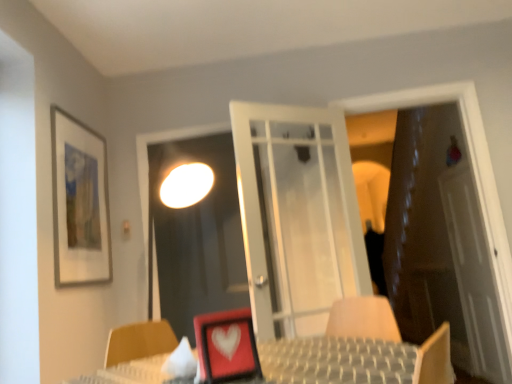
Question: From a real-world perspective, is brown leather door at right physically located above or below matte glass picture frame at upper left, positioned as the first picture frame in back-to-front order?

Choices:
 (A) above
 (B) below

Answer: (B)

Question: Relative to matte glass picture frame at upper left, positioned as the 2th picture frame in front-to-back order, is brown leather door at right in front or behind?

Choices:
 (A) front
 (B) behind

Answer: (B)

Question: Based on their relative distances, which object is farther from the matte glass picture frame at upper left, which is the second picture frame in right-to-left order?

Choices:
 (A) brown leather door at right
 (B) transparent glass screen door at center, the second screen door from the back
 (C) matte red picture frame at center, the second picture frame positioned from the left
 (D) white translucent screen door at right, which is counted as the 1th screen door, starting from the back

Answer: (A)

Question: Which object is positioned farthest from the white translucent screen door at right, which is counted as the 1th screen door, starting from the back?

Choices:
 (A) matte red picture frame at center, the second picture frame positioned from the left
 (B) matte glass picture frame at upper left, positioned as the 2th picture frame in front-to-back order
 (C) brown leather door at right
 (D) transparent glass screen door at center, which is counted as the second screen door, starting from the right

Answer: (B)